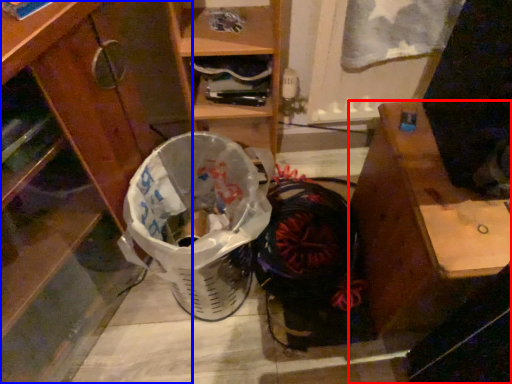
Question: Which object is further to the camera taking this photo, desk (highlighted by a red box) or cabinetry (highlighted by a blue box)?

Choices:
 (A) desk
 (B) cabinetry

Answer: (A)